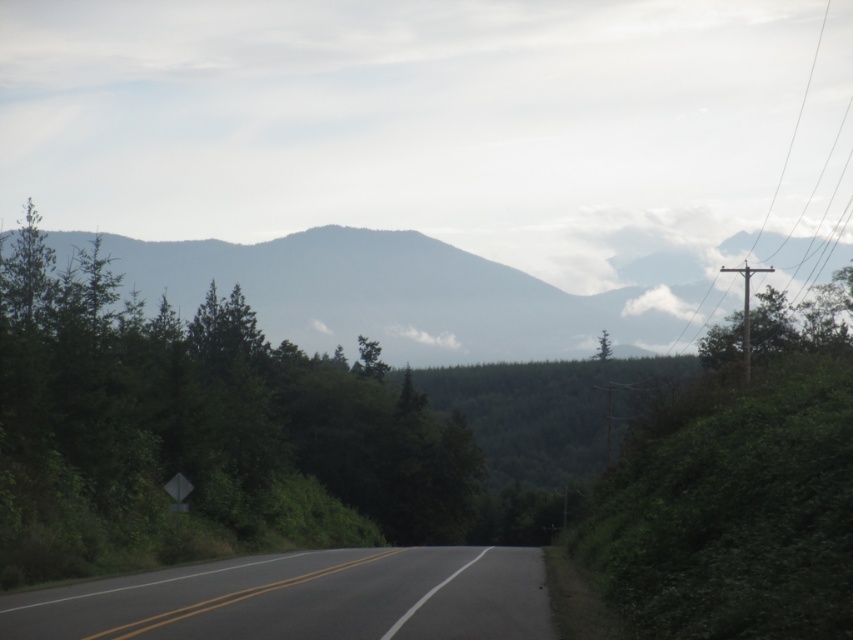
You are driving a car that is 15 feet long. You see the gray foggy mountain at center and the black asphalt road at center. Can your car fit entirely between them without touching either?

The gray foggy mountain at center and the black asphalt road at center are 424.83 feet apart. Since your car is only 15 feet long, it can easily fit between them without touching either.

From the picture: You are a hiker planning to take a photo of the gray foggy mountain at center and the green leafy tree at center. Which object should you focus on first to ensure both are in the frame?

The green leafy tree at center is above the gray foggy mountain at center, so you should focus on the gray foggy mountain at center first to ensure both are in the frame.

You are driving a car on the two lane road and see the point at (196,432). What object does this point correspond to?

The point at (196,432) corresponds to the green leafy tree at center.